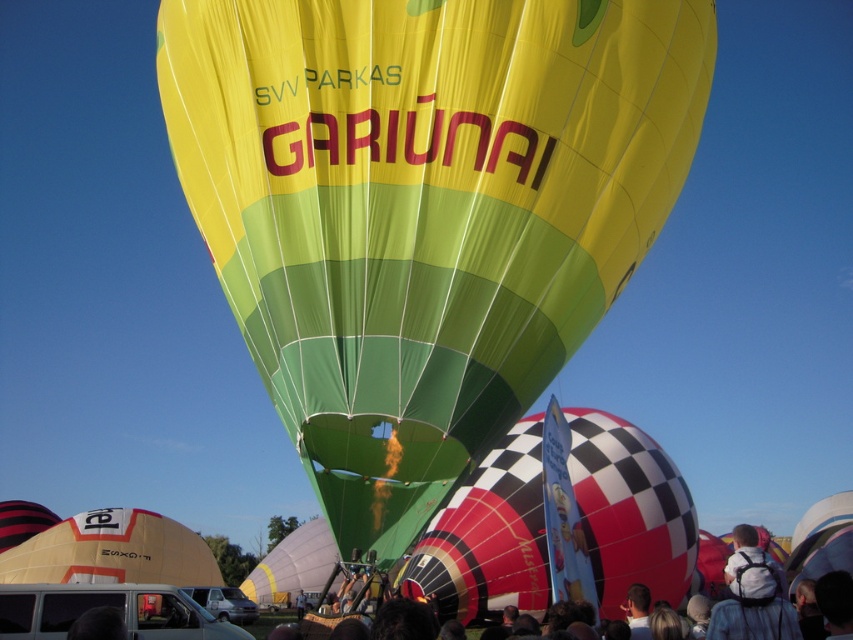
Who is shorter, checkered fabric balloon at center or white backpack at lower right?

checkered fabric balloon at center

Is checkered fabric balloon at center positioned in front of white backpack at lower right?

No, it is behind white backpack at lower right.

Which is in front, point (440, 580) or point (784, 593)?

Positioned in front is point (784, 593).

Where is `checkered fabric balloon at center`? The image size is (853, 640). checkered fabric balloon at center is located at coordinates (488, 536).

Between yellow/green striped fabric hot air balloon at center and white backpack at lower right, which one has more height?

yellow/green striped fabric hot air balloon at center

Does yellow/green striped fabric hot air balloon at center have a smaller size compared to white backpack at lower right?

Correct, yellow/green striped fabric hot air balloon at center occupies less space than white backpack at lower right.

Locate an element on the screen. yellow/green striped fabric hot air balloon at center is located at coordinates (422, 211).

Is checkered fabric balloon at center shorter than matte yellow tent at lower left?

No, checkered fabric balloon at center is not shorter than matte yellow tent at lower left.

Between point (456, 509) and point (62, 561), which one is positioned in front?

Point (456, 509)

Does point (595, 412) come closer to viewer compared to point (131, 547)?

Yes, point (595, 412) is closer to viewer.

Identify the location of checkered fabric balloon at center. (488, 536).